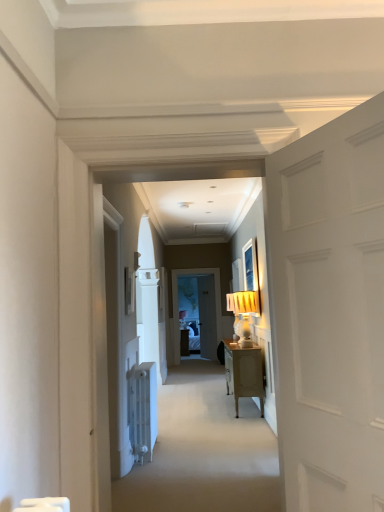
What do you see at coordinates (129, 290) in the screenshot? I see `matte white picture frame at upper left` at bounding box center [129, 290].

Identify the location of white matte door at right. This screenshot has width=384, height=512. (329, 311).

Identify the location of carpet at center. The image size is (384, 512). (204, 450).

In order to click on matte white picture frame at upper left in this screenshot , I will do `click(129, 290)`.

From the image's perspective, is white matte door at right below carpet at center?

No, from the image's perspective, white matte door at right is not below carpet at center.

Considering the relative sizes of white matte door at right and carpet at center in the image provided, is white matte door at right thinner than carpet at center?

Correct, the width of white matte door at right is less than that of carpet at center.

Is carpet at center at the back of white matte door at right?

That's not correct — white matte door at right is not looking away from carpet at center.

Is white matte door at right located outside carpet at center?

Yes, white matte door at right is not within carpet at center.

Consider the image. Is carpet at center bigger or smaller than matte white picture frame at upper left?

Clearly, carpet at center is larger in size than matte white picture frame at upper left.

From the image's perspective, is carpet at center beneath matte white picture frame at upper left?

Indeed, from the image's perspective, carpet at center is shown beneath matte white picture frame at upper left.

From the picture: Does carpet at center contain matte white picture frame at upper left?

No, matte white picture frame at upper left is located outside of carpet at center.

Between carpet at center and white matte door at right, which one is positioned in front?

white matte door at right.

Does carpet at center touch white matte door at right?

No, carpet at center is not with white matte door at right.

In the image, is white matte door at right positioned in front of or behind matte white picture frame at upper left?

white matte door at right is in front of matte white picture frame at upper left.

Consider the image. Which is more to the right, white matte door at right or matte white picture frame at upper left?

white matte door at right.

Are white matte door at right and matte white picture frame at upper left beside each other?

No, white matte door at right is not next to matte white picture frame at upper left.

Which of these two, white matte door at right or matte white picture frame at upper left, is wider?

Wider between the two is white matte door at right.

Consider the image. Can we say matte white picture frame at upper left lies outside carpet at center?

Yes, matte white picture frame at upper left is outside of carpet at center.

Does matte white picture frame at upper left turn towards carpet at center?

No, matte white picture frame at upper left does not turn towards carpet at center.

Are matte white picture frame at upper left and carpet at center far apart?

matte white picture frame at upper left is far away from carpet at center.

Locate an element on the screen. path in front of the matte white picture frame at upper left is located at coordinates (204, 450).

Which of these two, matte white picture frame at upper left or white matte door at right, stands shorter?

With less height is matte white picture frame at upper left.

From the image's perspective, is matte white picture frame at upper left on top of white matte door at right?

No.

Is matte white picture frame at upper left aimed at white matte door at right?

No, matte white picture frame at upper left is not facing towards white matte door at right.

Where is `door below the matte white picture frame at upper left (from a real-world perspective)`? The height and width of the screenshot is (512, 384). door below the matte white picture frame at upper left (from a real-world perspective) is located at coordinates (329, 311).

Where is `door in front of the carpet at center`? The image size is (384, 512). door in front of the carpet at center is located at coordinates (329, 311).

Where is `picture frame that is on the left side of carpet at center`? This screenshot has width=384, height=512. picture frame that is on the left side of carpet at center is located at coordinates (129, 290).

Based on their spatial positions, is matte white picture frame at upper left or carpet at center further from white matte door at right?

The object further to white matte door at right is matte white picture frame at upper left.

Estimate the real-world distances between objects in this image. Which object is further from matte white picture frame at upper left, carpet at center or white matte door at right?

white matte door at right is positioned further to the anchor matte white picture frame at upper left.

Consider the image. Estimate the real-world distances between objects in this image. Which object is further from white matte door at right, carpet at center or matte white picture frame at upper left?

matte white picture frame at upper left.

Based on their spatial positions, is white matte door at right or carpet at center further from matte white picture frame at upper left?

Based on the image, white matte door at right appears to be further to matte white picture frame at upper left.

Which object lies further to the anchor point carpet at center, matte white picture frame at upper left or white matte door at right?

Among the two, white matte door at right is located further to carpet at center.

From the image, which object appears to be farther from carpet at center, white matte door at right or matte white picture frame at upper left?

white matte door at right.

Find the location of a particular element. path positioned between white matte door at right and matte white picture frame at upper left from near to far is located at coordinates (204, 450).